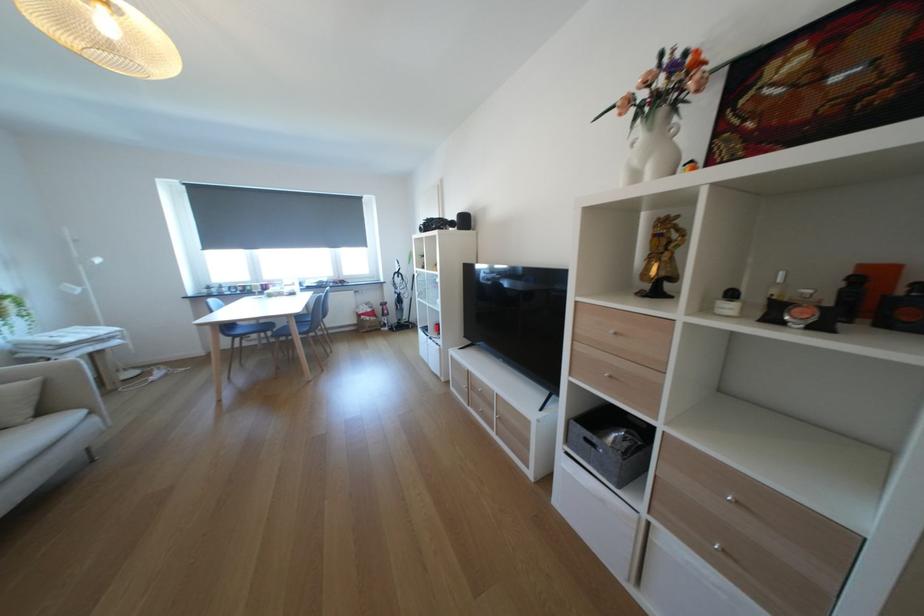
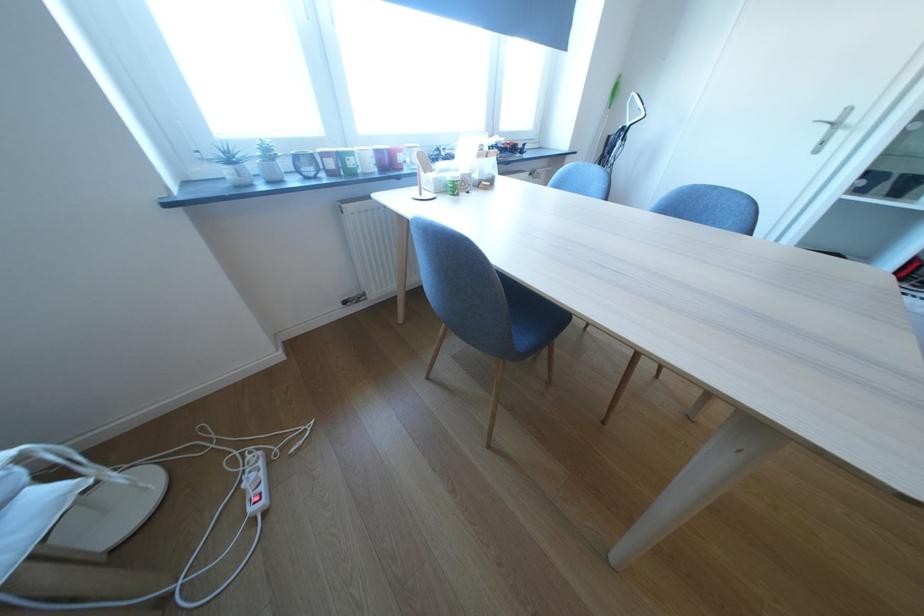
What movement of the cameraman would produce the second image?

The movement direction of the cameraman is left, forward.